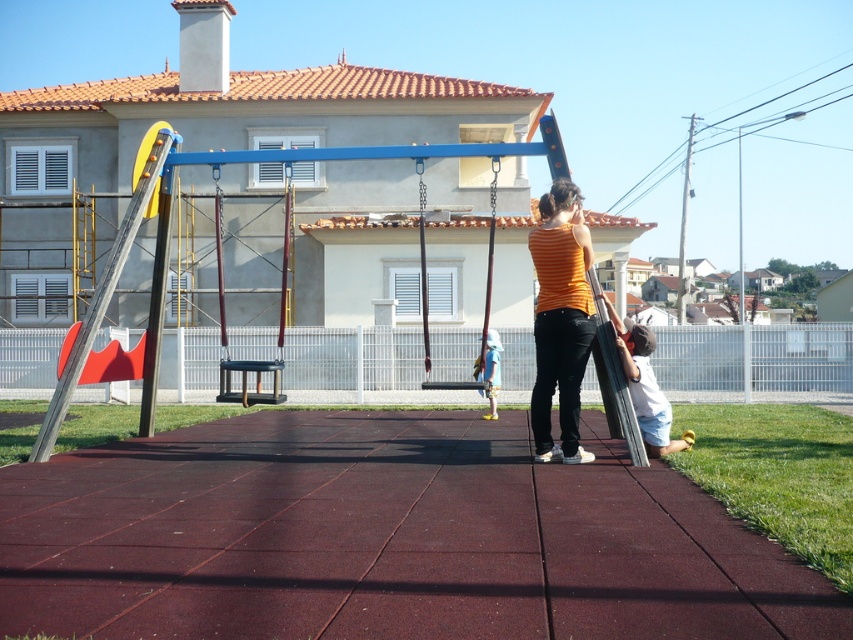
You are standing at the entrance of the playground and want to locate the orange matte tank top at center. According to the coordinates provided, where would you look relative to the playground entrance?

The orange matte tank top at center is located at coordinates point (x=560, y=320), which would be in the central area of the playground, approximately halfway between the entrance and the back of the scene.

You are standing at the point labeled point (584, 337) and want to walk towards the point labeled point (492, 397). Which direction should you face to move directly towards your destination?

Since point (584, 337) is in front of point (492, 397), you should face backward to move directly towards point (492, 397).

Based on the photo, you are a photographer trying to capture a candid shot of the woman in the playground. You notice the orange matte tank top at center and the light blue denim shorts at center. Which clothing item is positioned higher on her body?

The orange matte tank top at center is much taller than the light blue denim shorts at center, so the tank top is positioned higher on her body.